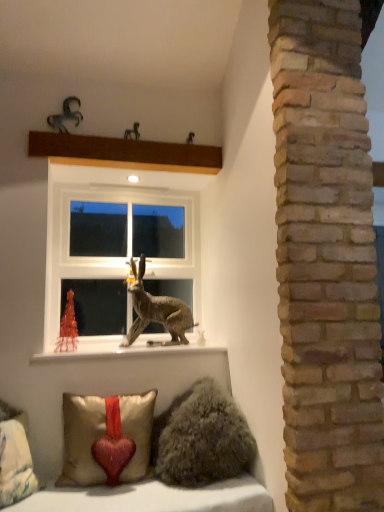
Question: From the image's perspective, is white plastic window at center positioned above or below metallic brown rabbit at center, placed as the third animal when sorted from front to back?

Choices:
 (A) below
 (B) above

Answer: (B)

Question: From a real-world perspective, is white plastic window at center above or below metallic brown rabbit at center, which appears as the 3th animal when viewed from the top?

Choices:
 (A) above
 (B) below

Answer: (A)

Question: Based on their relative distances, which object is nearer to the velvet beige pillow with red heart at lower left, arranged as the 1th pillow when viewed from the left?

Choices:
 (A) white plastic window at center
 (B) metallic brown rabbit at center, placed as the 3th animal when sorted from left to right
 (C) white glossy window sill at lower center
 (D) metallic horse at upper left, arranged as the 4th animal when viewed from the right
 (E) satin gold pillow with red heart at lower left, the second pillow from the left

Answer: (E)

Question: Estimate the real-world distances between objects in this image. Which object is farther from the metallic horse at upper left, the first animal viewed from the top?

Choices:
 (A) metallic horse at upper center, which is counted as the second animal, starting from the top
 (B) brown wooden beam at upper center
 (C) satin gold pillow with red heart at lower left, the first pillow positioned from the right
 (D) white glossy window sill at lower center
 (E) metallic brown rabbit at center, placed as the 2th animal when sorted from right to left

Answer: (C)